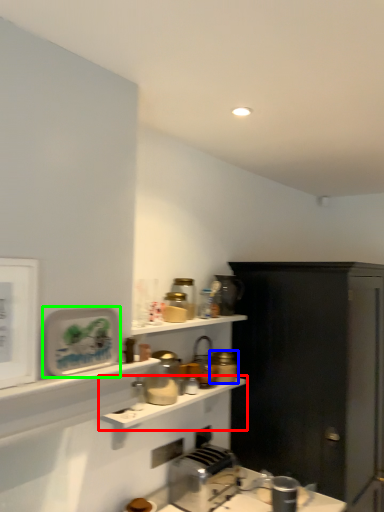
Question: Considering the real-world distances, which object is closest to shelf (highlighted by a red box)? appliance (highlighted by a blue box) or appliance (highlighted by a green box).

Choices:
 (A) appliance
 (B) appliance

Answer: (A)